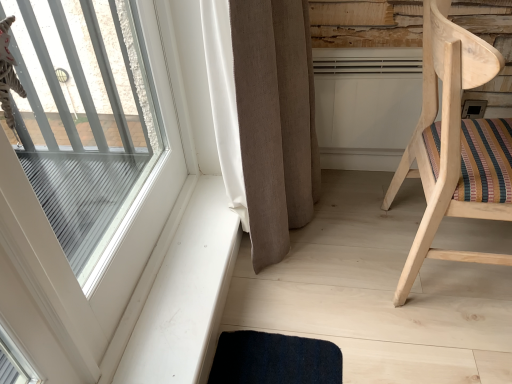
Question: Considering the positions of natural wood chair at right and white smooth window sill at lower left in the image, is natural wood chair at right taller or shorter than white smooth window sill at lower left?

Choices:
 (A) short
 (B) tall

Answer: (B)

Question: Considering the positions of natural wood chair at right and white smooth window sill at lower left in the image, is natural wood chair at right wider or thinner than white smooth window sill at lower left?

Choices:
 (A) thin
 (B) wide

Answer: (B)

Question: Which of these objects is positioned closest to the beige fabric curtain at center?

Choices:
 (A) natural wood chair at right
 (B) clear glass window at upper left
 (C) white smooth window sill at lower left

Answer: (C)

Question: Which of these objects is positioned closest to the clear glass window at upper left?

Choices:
 (A) natural wood chair at right
 (B) beige fabric curtain at center
 (C) white smooth window sill at lower left

Answer: (C)